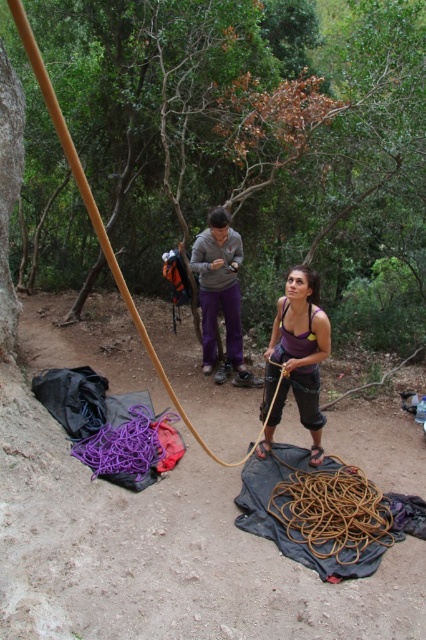
Question: Which object appears closest to the camera in this image?

Choices:
 (A) brown rope at lower center
 (B) matte gray hoodie at center
 (C) purple fabric tank top at center
 (D) brown wood pole at center

Answer: (A)

Question: Does brown wood pole at center come behind brown rope at lower center?

Choices:
 (A) yes
 (B) no

Answer: (A)

Question: Does purple fabric tank top at center appear on the right side of matte gray hoodie at center?

Choices:
 (A) yes
 (B) no

Answer: (A)

Question: Among these objects, which one is nearest to the camera?

Choices:
 (A) purple fabric tank top at center
 (B) matte gray hoodie at center
 (C) brown wood pole at center

Answer: (A)

Question: Based on their relative distances, which object is nearer to the brown rope at lower center?

Choices:
 (A) purple fabric tank top at center
 (B) brown wood pole at center

Answer: (A)

Question: Is brown rope at lower center to the right of purple fabric tank top at center from the viewer's perspective?

Choices:
 (A) no
 (B) yes

Answer: (B)